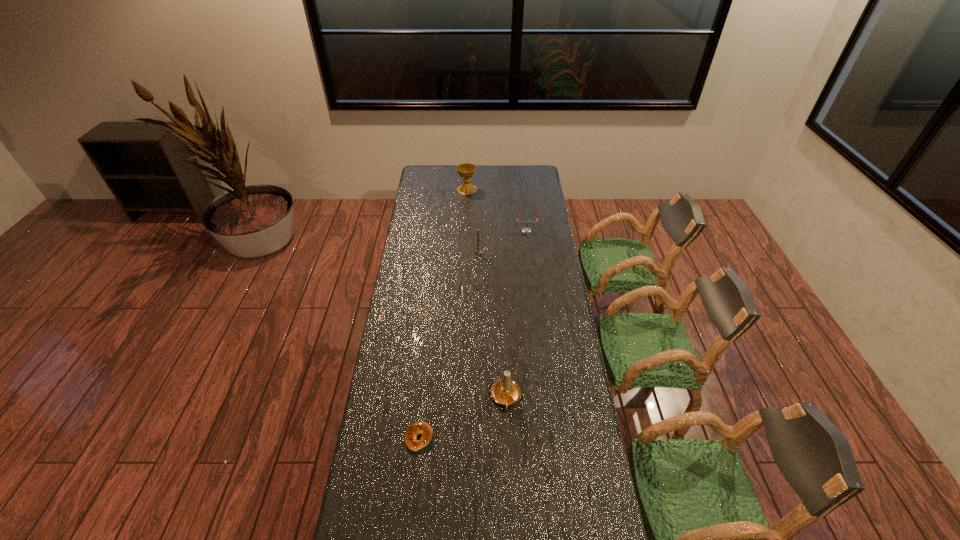
This screenshot has height=540, width=960. I want to click on free spot located on the left of the fourth farthest object, so click(452, 397).

You are a GUI agent. You are given a task and a screenshot of the screen. Output one action in this format:
    pyautogui.click(x=<x>, y=<y>)
    Task: Click on the free location located on the back of the leftmost candle
    Image resolution: width=960 pixels, height=540 pixels.
    Given the screenshot: What is the action you would take?
    pyautogui.click(x=478, y=214)

You are a GUI agent. You are given a task and a screenshot of the screen. Output one action in this format:
    pyautogui.click(x=<x>, y=<y>)
    Task: Click on the vacant space situated on the front-facing side of the second farthest object
    
    Given the screenshot: What is the action you would take?
    pyautogui.click(x=530, y=259)

I want to click on free region located 0.050m on the left of the leftmost object, so click(x=391, y=437).

I want to click on object present at the far edge, so click(x=466, y=170).

The width and height of the screenshot is (960, 540). In order to click on object located in the left edge section of the desktop in this screenshot , I will do `click(415, 429)`.

Locate an element on the screen. This screenshot has height=540, width=960. object that is at the right edge is located at coordinates (526, 230).

In the image, there is a desktop. At what (x,y) coordinates should I click in order to perform the action: click on vacant space at the left edge. Please return your answer as a coordinate pair (x, y). Image resolution: width=960 pixels, height=540 pixels. Looking at the image, I should click on (386, 360).

In the image, there is a desktop. At what (x,y) coordinates should I click in order to perform the action: click on vacant space at the right edge. Please return your answer as a coordinate pair (x, y). Looking at the image, I should click on (571, 321).

The image size is (960, 540). I want to click on vacant point at the far right corner, so click(534, 172).